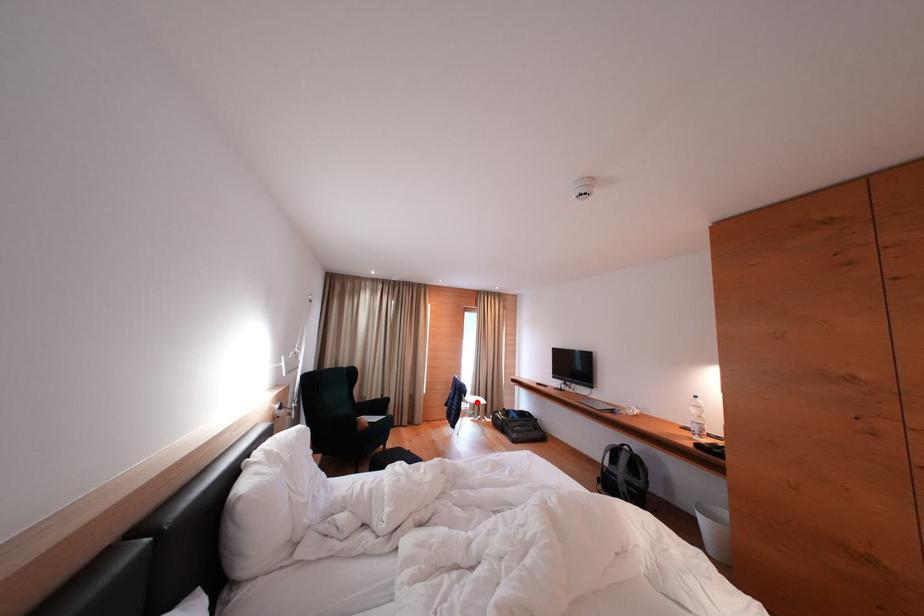
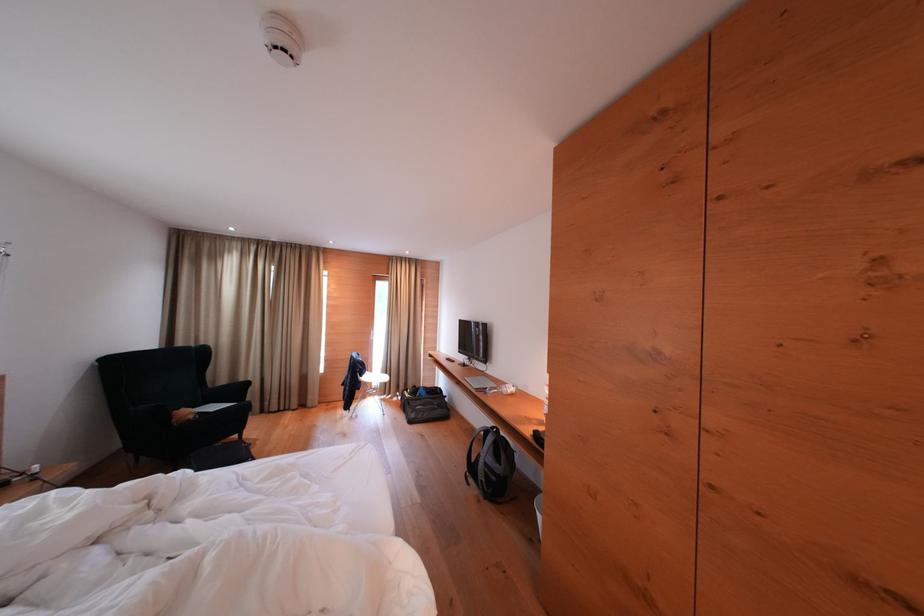
Find the pixel in the second image that matches the highlighted location in the first image.

(383, 379)